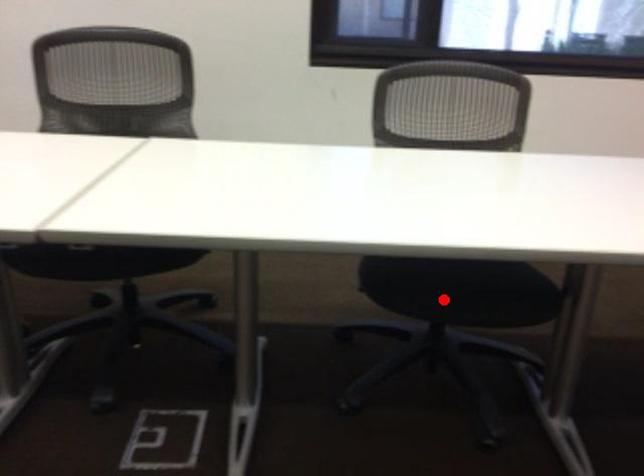
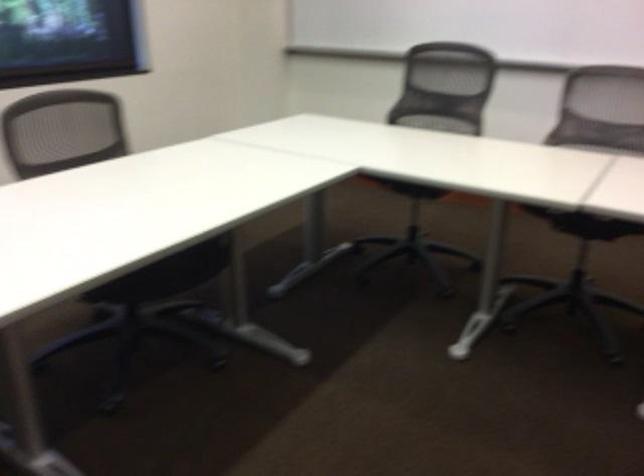
In the second image, find the point that corresponds to the highlighted location in the first image.

(166, 275)